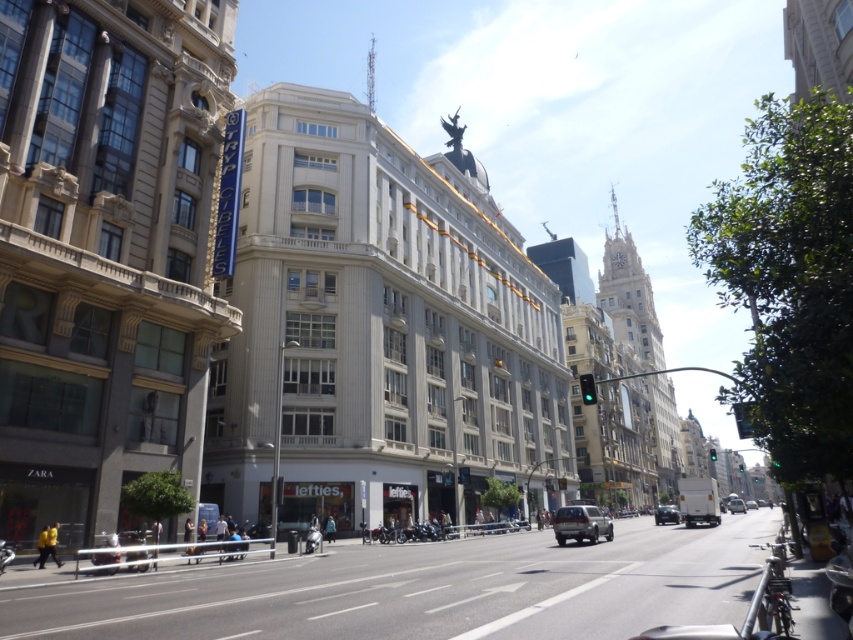
You are a delivery driver who needs to park your vehicle in a space that can only accommodate vehicles up to the size of the silver metallic van at center. You are driving a silver metallic suv at center. Based on the scene, will your vehicle fit in the designated parking space?

The silver metallic suv at center is bigger than the silver metallic van at center, so your vehicle will not fit in the designated parking space.

You are standing at the crosswalk in the middle of the street. You see a point marked at coordinates [579,524]. What object is located at that point?

The point at coordinates [579,524] indicates a silver metallic suv at center.